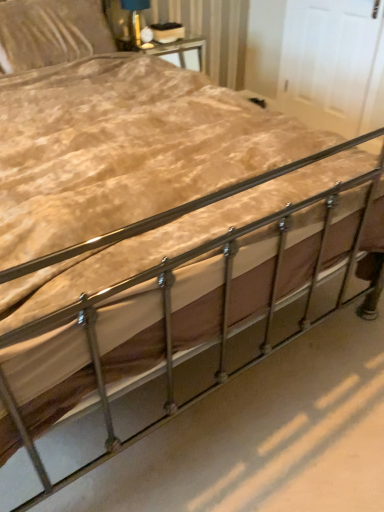
Question: Is matte black lampshade at upper center spatially inside velvet beige pillow at upper left, or outside of it?

Choices:
 (A) inside
 (B) outside

Answer: (B)

Question: Considering the relative positions of matte black lampshade at upper center and velvet beige pillow at upper left in the image provided, is matte black lampshade at upper center to the left or to the right of velvet beige pillow at upper left?

Choices:
 (A) right
 (B) left

Answer: (A)

Question: From a real-world perspective, is matte black lampshade at upper center positioned above or below velvet beige pillow at upper left?

Choices:
 (A) below
 (B) above

Answer: (B)

Question: Looking at the image, does velvet beige pillow at upper left seem bigger or smaller compared to matte black lampshade at upper center?

Choices:
 (A) small
 (B) big

Answer: (B)

Question: Is velvet beige pillow at upper left in front of or behind matte black lampshade at upper center in the image?

Choices:
 (A) behind
 (B) front

Answer: (B)

Question: Considering the positions of point tap(102, 50) and point tap(135, 5), is point tap(102, 50) closer or farther from the camera than point tap(135, 5)?

Choices:
 (A) farther
 (B) closer

Answer: (B)

Question: Is velvet beige pillow at upper left taller or shorter than matte black lampshade at upper center?

Choices:
 (A) tall
 (B) short

Answer: (A)